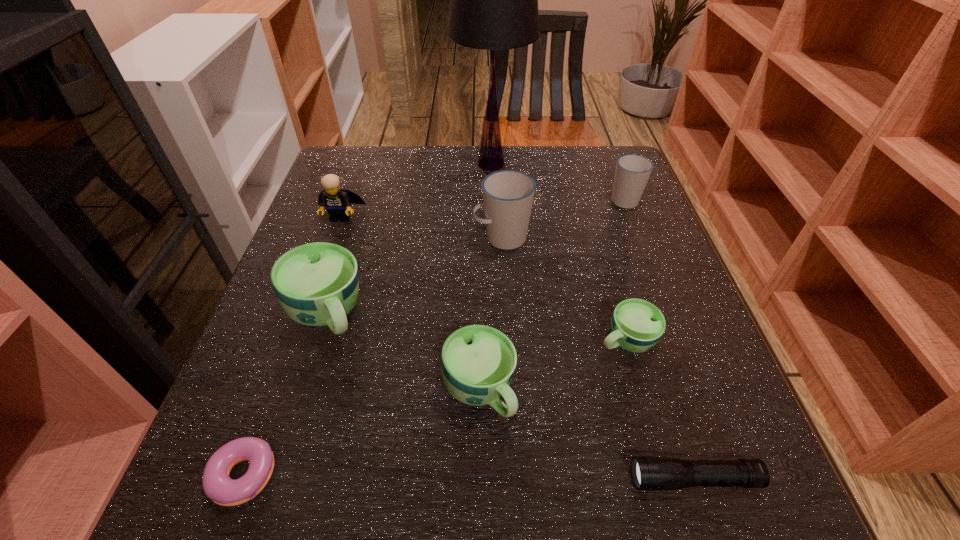
Where is `free space located at the lens end of the flashlight`? This screenshot has height=540, width=960. free space located at the lens end of the flashlight is located at coordinates (576, 479).

I want to click on blank area located on the right of the purple doughnut, so click(483, 482).

I want to click on lampshade located at the far edge, so click(x=493, y=0).

The width and height of the screenshot is (960, 540). In order to click on cup positioned at the far edge in this screenshot , I will do tap(632, 172).

Find the location of a particular element. flashlight that is at the near edge is located at coordinates [x=649, y=473].

I want to click on doughnut at the near edge, so click(218, 486).

The width and height of the screenshot is (960, 540). I want to click on Lego situated at the left edge, so click(x=338, y=202).

Where is `cup present at the left edge`? The width and height of the screenshot is (960, 540). cup present at the left edge is located at coordinates (317, 284).

You are a GUI agent. You are given a task and a screenshot of the screen. Output one action in this format:
    pyautogui.click(x=<x>, y=<y>)
    Task: Click on the doughnut that is positioned at the left edge
    Image resolution: width=960 pixels, height=540 pixels.
    Given the screenshot: What is the action you would take?
    pyautogui.click(x=218, y=486)

In order to click on flashlight that is positioned at the right edge in this screenshot , I will do `click(649, 473)`.